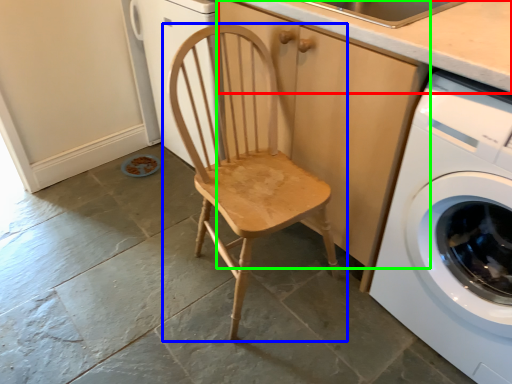
Question: Which object is positioned farthest from counter top (highlighted by a red box)? Select from chair (highlighted by a blue box) and cabinetry (highlighted by a green box).

Choices:
 (A) chair
 (B) cabinetry

Answer: (A)